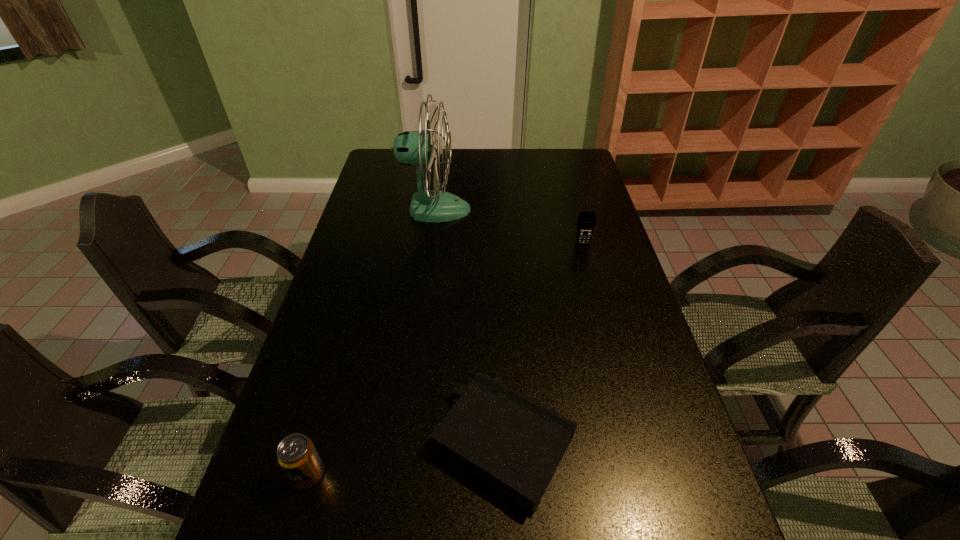
Locate an element on the screen. fan is located at coordinates (412, 148).

Locate an element on the screen. the farthest object is located at coordinates (412, 148).

The image size is (960, 540). Find the location of `cellular telephone`. cellular telephone is located at coordinates (586, 222).

This screenshot has height=540, width=960. Identify the location of the second farthest object. (586, 222).

The image size is (960, 540). What are the coordinates of `the leftmost object` in the screenshot? It's located at (297, 456).

At what (x,y) coordinates should I click in order to perform the action: click on Bible. Please return your answer as a coordinate pair (x, y). Looking at the image, I should click on (514, 443).

At what (x,y) coordinates should I click in order to perform the action: click on vacant position located 0.150m in front of the farthest object, directing airflow. Please return your answer as a coordinate pair (x, y). This screenshot has height=540, width=960. Looking at the image, I should click on (512, 210).

The height and width of the screenshot is (540, 960). What are the coordinates of `vacant area located on the screen of the third nearest object` in the screenshot? It's located at (606, 329).

Where is `vacant position located on the right of the leftmost object`? vacant position located on the right of the leftmost object is located at coordinates (383, 474).

Where is `free space located on the right of the shortest object`? This screenshot has height=540, width=960. free space located on the right of the shortest object is located at coordinates (667, 442).